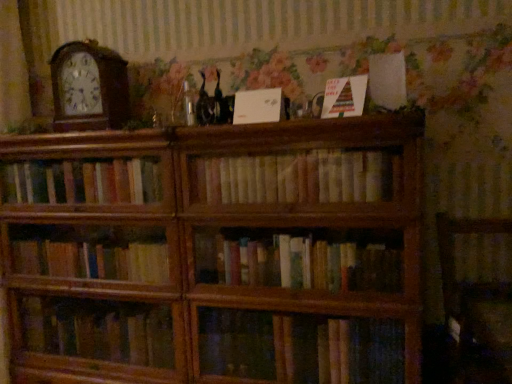
Image resolution: width=512 pixels, height=384 pixels. What do you see at coordinates (296, 178) in the screenshot? I see `light brown wood bookshelf at center` at bounding box center [296, 178].

What do you see at coordinates (215, 253) in the screenshot? I see `wooden bookcase at center` at bounding box center [215, 253].

What are the coordinates of `multicolored paper at upper center, arranged as the first paperback book when viewed from the right` in the screenshot? It's located at (344, 97).

What is the approximate height of white matte paper at upper center, which is counted as the 2th paperback book, starting from the right?

white matte paper at upper center, which is counted as the 2th paperback book, starting from the right, is 5.60 inches in height.

Locate an element on the screen. This screenshot has width=512, height=384. light brown wood bookshelf at center is located at coordinates (296, 178).

From the image's perspective, which is above, wooden bookcase at center or wooden armchair at lower right?

wooden bookcase at center, from the image's perspective.

Consider the image. Is wooden bookcase at center surrounding wooden armchair at lower right?

Actually, wooden armchair at lower right is outside wooden bookcase at center.

What are the coordinates of `bookcase located above the wooden armchair at lower right (from the image's perspective)` in the screenshot? It's located at (215, 253).

From their relative heights in the image, would you say wooden bookcase at center is taller or shorter than wooden armchair at lower right?

In the image, wooden bookcase at center appears to be taller than wooden armchair at lower right.

Which of these two, multicolored paper at upper center, marked as the 2th paperback book in a left-to-right arrangement, or white matte paper at upper center, the first paperback book in the left-to-right sequence, is bigger?

Bigger between the two is multicolored paper at upper center, marked as the 2th paperback book in a left-to-right arrangement.

Is multicolored paper at upper center, marked as the 2th paperback book in a left-to-right arrangement, inside or outside of white matte paper at upper center, the first paperback book in the left-to-right sequence?

multicolored paper at upper center, marked as the 2th paperback book in a left-to-right arrangement, exists outside the volume of white matte paper at upper center, the first paperback book in the left-to-right sequence.

From the image's perspective, which is below, multicolored paper at upper center, arranged as the first paperback book when viewed from the right, or white matte paper at upper center, which is counted as the 2th paperback book, starting from the right?

From the image's view, white matte paper at upper center, which is counted as the 2th paperback book, starting from the right, is below.

Is the position of multicolored paper at upper center, marked as the 2th paperback book in a left-to-right arrangement, more distant than that of white matte paper at upper center, the first paperback book in the left-to-right sequence?

No, multicolored paper at upper center, marked as the 2th paperback book in a left-to-right arrangement, is closer to the viewer.

Does light brown wood bookshelf at center have a greater width compared to multicolored paper at upper center, arranged as the first paperback book when viewed from the right?

Indeed, light brown wood bookshelf at center has a greater width compared to multicolored paper at upper center, arranged as the first paperback book when viewed from the right.

Is multicolored paper at upper center, arranged as the first paperback book when viewed from the right, surrounded by light brown wood bookshelf at center?

Actually, multicolored paper at upper center, arranged as the first paperback book when viewed from the right, is outside light brown wood bookshelf at center.

Is light brown wood bookshelf at center looking in the opposite direction of multicolored paper at upper center, marked as the 2th paperback book in a left-to-right arrangement?

No, light brown wood bookshelf at center is not facing away from multicolored paper at upper center, marked as the 2th paperback book in a left-to-right arrangement.

Is point (66, 103) farther from camera compared to point (327, 114)?

Yes, point (66, 103) is behind point (327, 114).

Is wooden clock at left to the left or to the right of multicolored paper at upper center, marked as the 2th paperback book in a left-to-right arrangement, in the image?

Clearly, wooden clock at left is on the left of multicolored paper at upper center, marked as the 2th paperback book in a left-to-right arrangement, in the image.

Is wooden clock at left not near multicolored paper at upper center, arranged as the first paperback book when viewed from the right?

wooden clock at left is actually quite close to multicolored paper at upper center, arranged as the first paperback book when viewed from the right.

From a real-world perspective, is wooden clock at left under multicolored paper at upper center, marked as the 2th paperback book in a left-to-right arrangement?

No, from a real-world perspective, wooden clock at left is not below multicolored paper at upper center, marked as the 2th paperback book in a left-to-right arrangement.

From the image's perspective, is white matte paper at upper center, the first paperback book in the left-to-right sequence, located beneath wooden clock at left?

Indeed, from the image's perspective, white matte paper at upper center, the first paperback book in the left-to-right sequence, is shown beneath wooden clock at left.

Image resolution: width=512 pixels, height=384 pixels. Identify the location of the 2nd paperback book positioned below the wooden clock at left (from a real-world perspective). (257, 106).

Does white matte paper at upper center, which is counted as the 2th paperback book, starting from the right, have a greater height compared to wooden clock at left?

Incorrect, the height of white matte paper at upper center, which is counted as the 2th paperback book, starting from the right, is not larger of that of wooden clock at left.

Consider the image. From the image's perspective, relative to white matte paper at upper center, which is counted as the 2th paperback book, starting from the right, is wooden clock at left above or below?

Based on their image positions, wooden clock at left is located above white matte paper at upper center, which is counted as the 2th paperback book, starting from the right.

Is wooden clock at left touching white matte paper at upper center, the first paperback book in the left-to-right sequence?

No, wooden clock at left is not with white matte paper at upper center, the first paperback book in the left-to-right sequence.

Can you confirm if wooden clock at left is thinner than white matte paper at upper center, which is counted as the 2th paperback book, starting from the right?

No.

Between wooden clock at left and white matte paper at upper center, which is counted as the 2th paperback book, starting from the right, which one has larger size?

Bigger between the two is wooden clock at left.

Considering the sizes of objects wooden clock at left and wooden armchair at lower right in the image provided, who is smaller, wooden clock at left or wooden armchair at lower right?

wooden clock at left is smaller.

Where is `clock on the left of the wooden armchair at lower right`? The width and height of the screenshot is (512, 384). clock on the left of the wooden armchair at lower right is located at coordinates (89, 87).

Consider the image. Could you tell me if wooden clock at left is facing wooden armchair at lower right?

No, wooden clock at left is not turned towards wooden armchair at lower right.

How many degrees apart are the facing directions of wooden clock at left and wooden armchair at lower right?

There is a 3.21-degree angle between the facing directions of wooden clock at left and wooden armchair at lower right.

Identify the location of armchair beneath the wooden bookcase at center (from a real-world perspective). (476, 305).

The width and height of the screenshot is (512, 384). There is a white matte paper at upper center, the first paperback book in the left-to-right sequence. What are the coordinates of `paperback book above it (from a real-world perspective)` in the screenshot? It's located at (344, 97).

Based on their spatial positions, is wooden armchair at lower right or white matte paper at upper center, the first paperback book in the left-to-right sequence, closer to light brown wood bookshelf at center?

Among the two, white matte paper at upper center, the first paperback book in the left-to-right sequence, is located nearer to light brown wood bookshelf at center.

From the image, which object appears to be farther from wooden bookcase at center, wooden armchair at lower right or white matte paper at upper center, the first paperback book in the left-to-right sequence?

The object further to wooden bookcase at center is wooden armchair at lower right.

Looking at the image, which one is located closer to wooden armchair at lower right, multicolored paper at upper center, arranged as the first paperback book when viewed from the right, or white matte paper at upper center, the first paperback book in the left-to-right sequence?

multicolored paper at upper center, arranged as the first paperback book when viewed from the right, lies closer to wooden armchair at lower right than the other object.

Based on their spatial positions, is wooden clock at left or white matte paper at upper center, the first paperback book in the left-to-right sequence, closer to wooden armchair at lower right?

white matte paper at upper center, the first paperback book in the left-to-right sequence, lies closer to wooden armchair at lower right than the other object.

From the image, which object appears to be farther from wooden armchair at lower right, wooden clock at left or multicolored paper at upper center, marked as the 2th paperback book in a left-to-right arrangement?

wooden clock at left.

Considering their positions, is wooden armchair at lower right positioned further to multicolored paper at upper center, arranged as the first paperback book when viewed from the right, than white matte paper at upper center, the first paperback book in the left-to-right sequence?

Based on the image, wooden armchair at lower right appears to be further to multicolored paper at upper center, arranged as the first paperback book when viewed from the right.

When comparing their distances from wooden bookcase at center, does wooden clock at left or wooden armchair at lower right seem closer?

wooden clock at left.

Based on their spatial positions, is white matte paper at upper center, the first paperback book in the left-to-right sequence, or wooden clock at left closer to wooden bookcase at center?

Based on the image, wooden clock at left appears to be nearer to wooden bookcase at center.

Locate an element on the screen. The height and width of the screenshot is (384, 512). book located between wooden bookcase at center and wooden armchair at lower right in the left-right direction is located at coordinates (296, 178).

You are a GUI agent. You are given a task and a screenshot of the screen. Output one action in this format:
    pyautogui.click(x=<x>, y=<y>)
    Task: Click on the book that lies between white matte paper at upper center, the first paperback book in the left-to-right sequence, and wooden bookcase at center from top to bottom
    The width and height of the screenshot is (512, 384).
    Given the screenshot: What is the action you would take?
    click(x=296, y=178)

Image resolution: width=512 pixels, height=384 pixels. In order to click on paperback book between multicolored paper at upper center, arranged as the first paperback book when viewed from the right, and light brown wood bookshelf at center in the up-down direction in this screenshot , I will do `click(257, 106)`.

Image resolution: width=512 pixels, height=384 pixels. I want to click on paperback book situated between wooden clock at left and light brown wood bookshelf at center from left to right, so click(x=257, y=106).